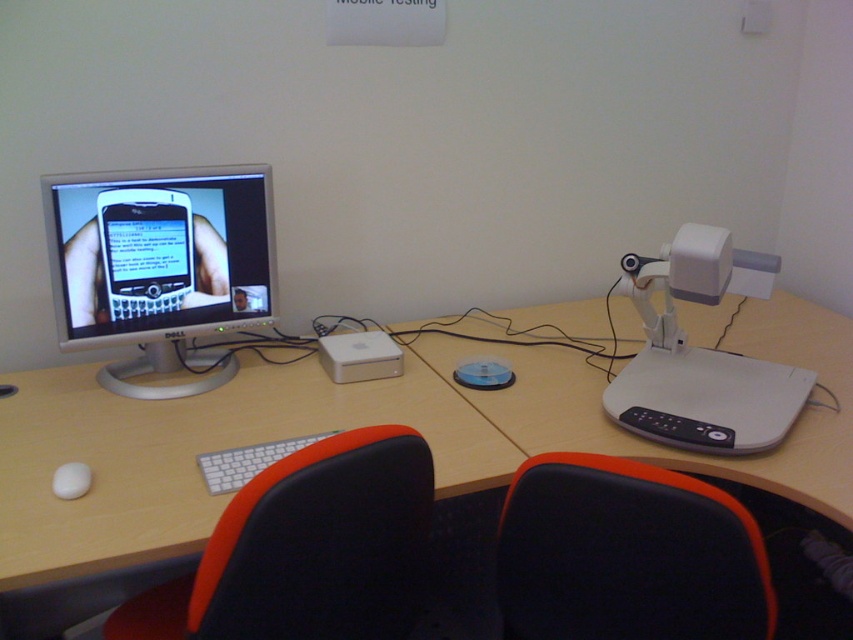
Is point (258, 412) closer to camera compared to point (378, 419)?

No.

At what (x,y) coordinates should I click in order to perform the action: click on light brown wood table at center. Please return your answer as a coordinate pair (x, y). The width and height of the screenshot is (853, 640). Looking at the image, I should click on (366, 424).

Can you confirm if wooden table at center is positioned above white plastic table at center?

No.

Between wooden table at center and white plastic table at center, which one is positioned lower?

wooden table at center

The height and width of the screenshot is (640, 853). I want to click on wooden table at center, so click(193, 456).

Does point (201, 209) come closer to viewer compared to point (202, 468)?

No, (201, 209) is further to viewer.

Does point (122, 172) lie in front of point (236, 468)?

No, it is behind (236, 468).

Find the location of a particular element. Image resolution: width=853 pixels, height=640 pixels. satin silver monitor at upper left is located at coordinates (160, 252).